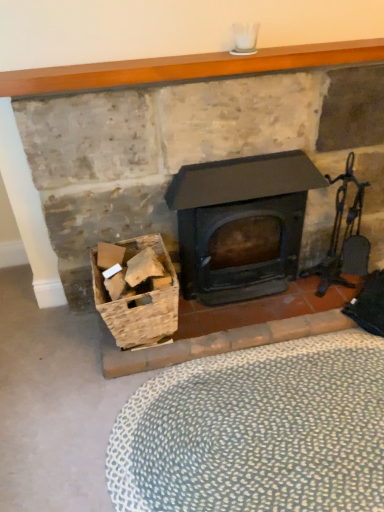
The height and width of the screenshot is (512, 384). What are the coordinates of `free space to the back side of metallic dark brown fireplace tool set at right` in the screenshot? It's located at (321, 274).